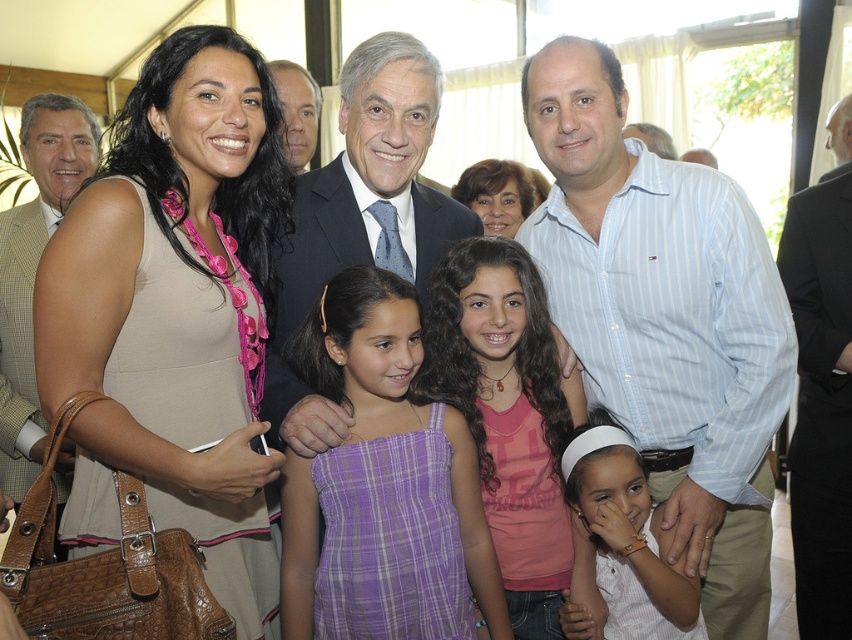
Is beige fabric dress at center positioned in front of light blue striped shirt at center?

That is True.

Where is `beige fabric dress at center`? The image size is (852, 640). beige fabric dress at center is located at coordinates (176, 314).

Between yellow-green checkered suit at left and smooth skin face at center, which one appears on the left side from the viewer's perspective?

Positioned to the left is yellow-green checkered suit at left.

Is point (9, 243) more distant than point (304, 68)?

That is False.

Is point (33, 150) more distant than point (314, 104)?

No, it is not.

This screenshot has width=852, height=640. Identify the location of yellow-green checkered suit at left. (33, 268).

Which is below, white matte shirt at center or smooth skin face at center?

white matte shirt at center is lower down.

Looking at this image, does white matte shirt at center come in front of smooth skin face at center?

Yes, it is.

Measure the distance between white matte shirt at center and camera.

They are 1.52 meters apart.

Identify the location of white matte shirt at center. (626, 540).